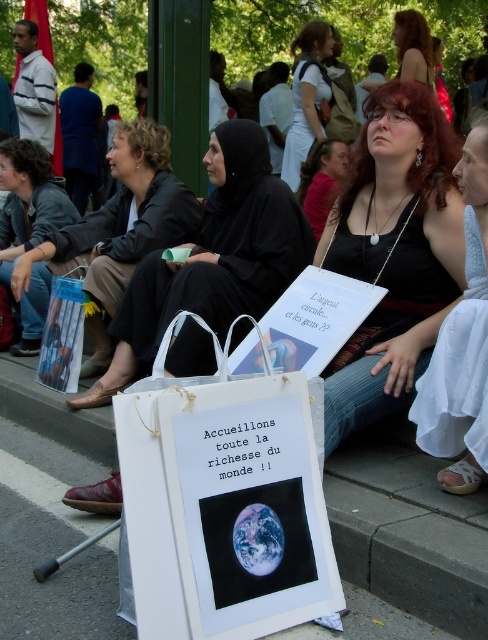
Question: Is denim jacket at left above matte black hijab at center?

Choices:
 (A) yes
 (B) no

Answer: (B)

Question: Which object appears closest to the camera in this image?

Choices:
 (A) blonde hair at upper center
 (B) black fabric hijab at upper center
 (C) black fabric hijab at center
 (D) white satin dress at center

Answer: (D)

Question: Which point appears closest to the camera in this image?

Choices:
 (A) (399, 74)
 (B) (415, 280)
 (C) (14, 520)
 (D) (162, 506)

Answer: (D)

Question: Can you confirm if black fabric jacket at upper left is positioned to the right of black fabric hijab at upper center?

Choices:
 (A) no
 (B) yes

Answer: (A)

Question: In this image, where is matte black tank top at center located relative to white satin dress at center?

Choices:
 (A) left
 (B) right

Answer: (A)

Question: Which point is closer to the camera taking this photo?

Choices:
 (A) (45, 262)
 (B) (189, 348)

Answer: (B)